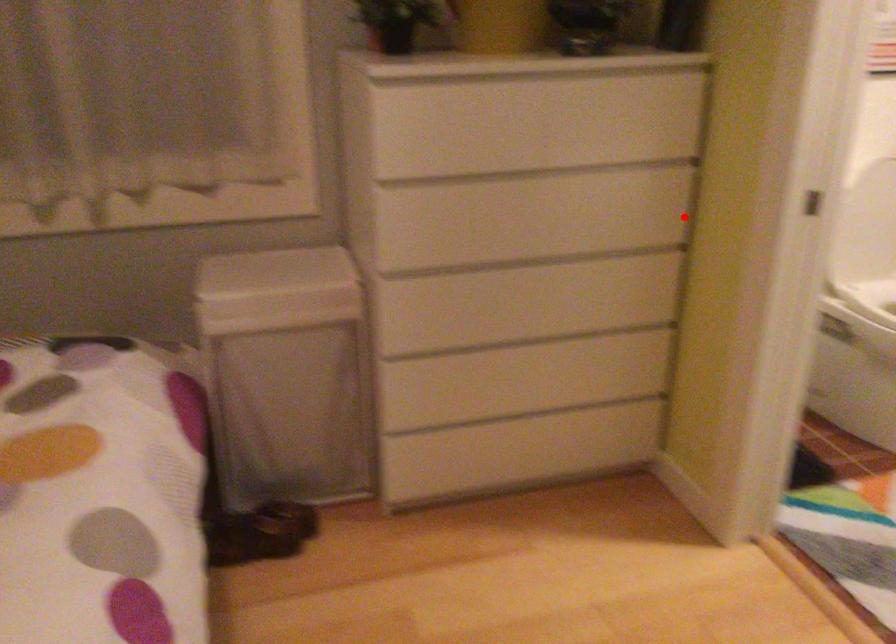
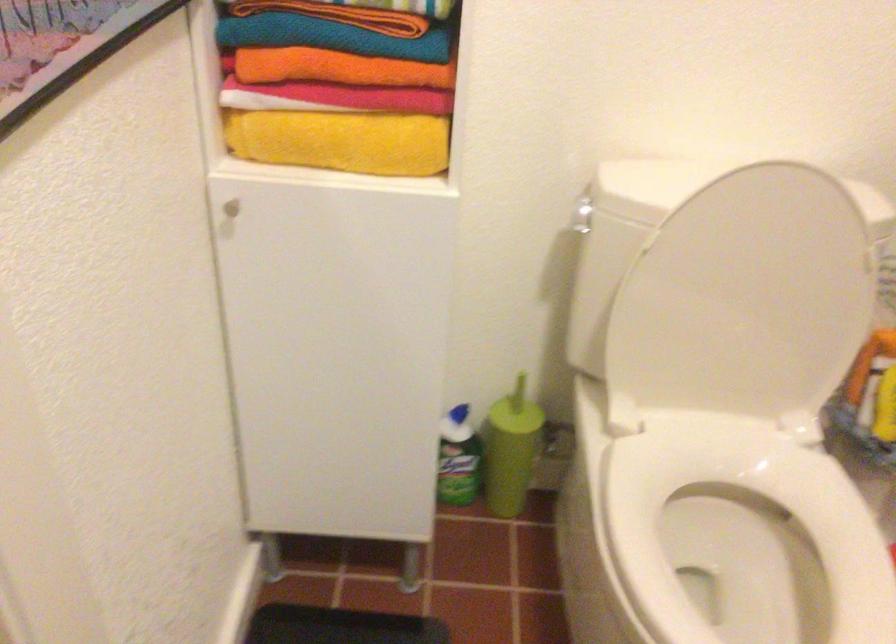
Question: I am providing you with two images of the same scene from different viewpoints. Image1 has a red point marked. In image2, the corresponding 3D location appears at what relative position? Reply with the corresponding letter.

Choices:
 (A) Closer
 (B) Farther

Answer: (A)